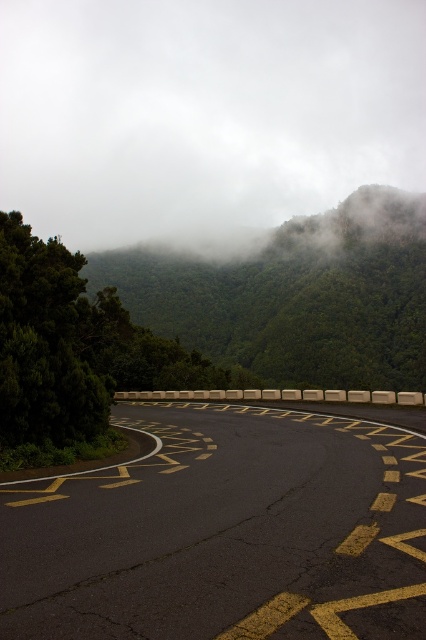
Can you confirm if white foggy cloud at upper center is thinner than yellow asphalt road at center?

No, white foggy cloud at upper center is not thinner than yellow asphalt road at center.

The width and height of the screenshot is (426, 640). I want to click on white foggy cloud at upper center, so 204,115.

Does point (25, 192) come behind point (313, 304)?

Yes, point (25, 192) is farther from viewer.

Can you confirm if white foggy cloud at upper center is taller than green leafy forest at upper center?

Indeed, white foggy cloud at upper center has a greater height compared to green leafy forest at upper center.

Between point (261, 157) and point (112, 282), which one is positioned in front?

Point (112, 282)

Where is `white foggy cloud at upper center`? white foggy cloud at upper center is located at coordinates (204, 115).

Is yellow asphalt road at center above green leafy forest at upper center?

No.

The width and height of the screenshot is (426, 640). Identify the location of yellow asphalt road at center. (224, 534).

Is point (265, 580) less distant than point (172, 259)?

Yes.

Image resolution: width=426 pixels, height=640 pixels. Identify the location of yellow asphalt road at center. (224, 534).